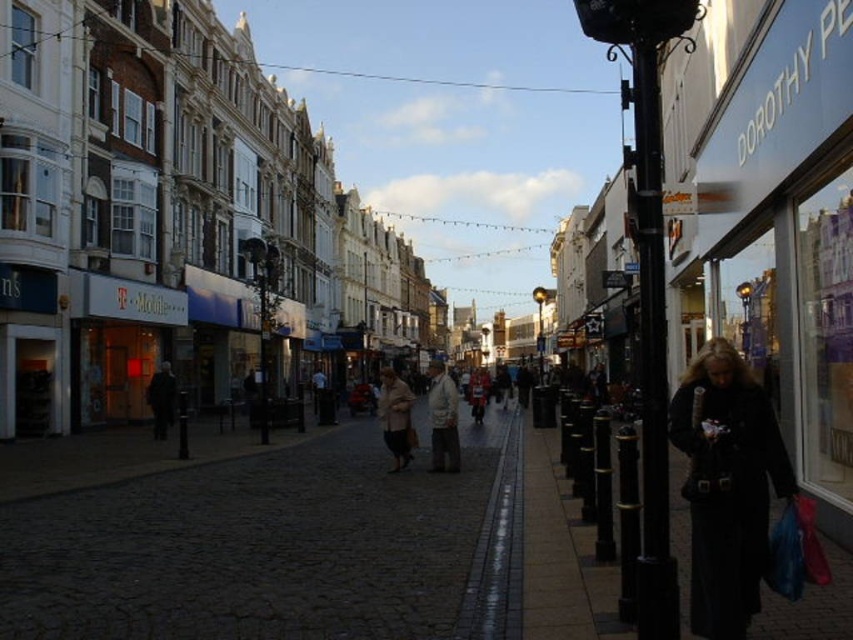
You are a street cleaner who needs to pick up the red plastic bag at lower right and the light beige coat at center. Which item is taller?

The light beige coat at center is taller than the red plastic bag at lower right.

You are standing at the point marked by the coordinates point (271,548) in the image. What is the surface you are currently standing on?

The surface at point (271,548) is the dark cobblestone pavement at center.